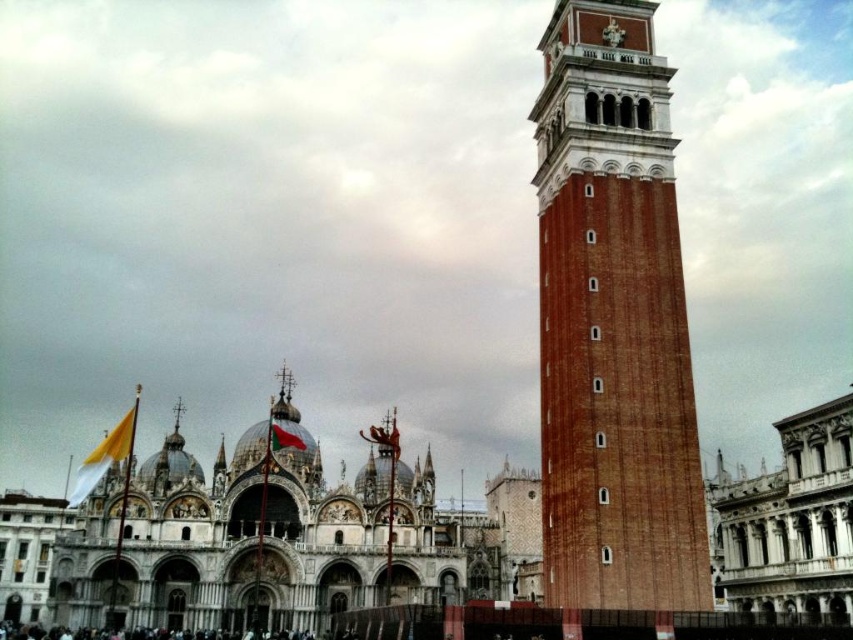
You are a tourist standing at the base of the Campanile di San Marco on the right. You see the white fabric flag at lower left and the red fabric flag at center. Which flag is closer to you?

The white fabric flag at lower left is closer to you since it is positioned at lower left compared to the red fabric flag at center, which is further away.

You are a tourist standing at the red fabric flag at center, wanting to take a photo of the brick textured bell tower at right. If your camera can focus on objects up to 40 meters away, will you be able to capture a clear photo of the bell tower?

The distance between the brick textured bell tower at right and the red fabric flag at center is 38.93 meters, which is within the camera focus range of 40 meters. Therefore, you can capture a clear photo of the brick textured bell tower at right.